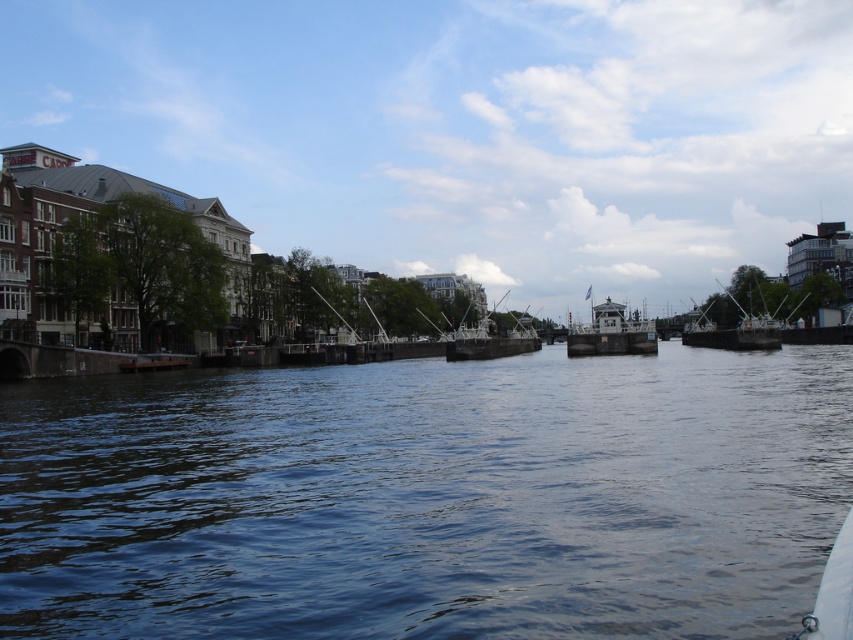
Consider the image. You are a tourist standing on the canal bank and want to take a photo of both the metallic gray boat at right and the metallic silver boat at center. Which boat should you position yourself closer to in order to include both in the frame without zooming?

You should position yourself closer to the metallic silver boat at center because the metallic gray boat at right is positioned on the right side of it, allowing both boats to be captured in the frame without zooming.

You are a tourist standing on the canal bridge and want to take a photo of the metallic gray boat at right. Where should you position yourself to capture the boat in the frame?

To capture the metallic gray boat at right in your photo, position yourself at the canal bridge closest to the boat, ensuring the boat is centered in your frame. Since the boat is located at coordinates approximately 0.520 on the x and 0.865 on the y axis, align your camera accordingly for optimal framing.

You are standing on the bank of the canal and want to know the distance between the dark blue water at center and the metallic silver boat at center. Can you estimate how far apart they are?

The dark blue water at center is 59.46 meters away from the metallic silver boat at center, so they are approximately 59.46 meters apart.